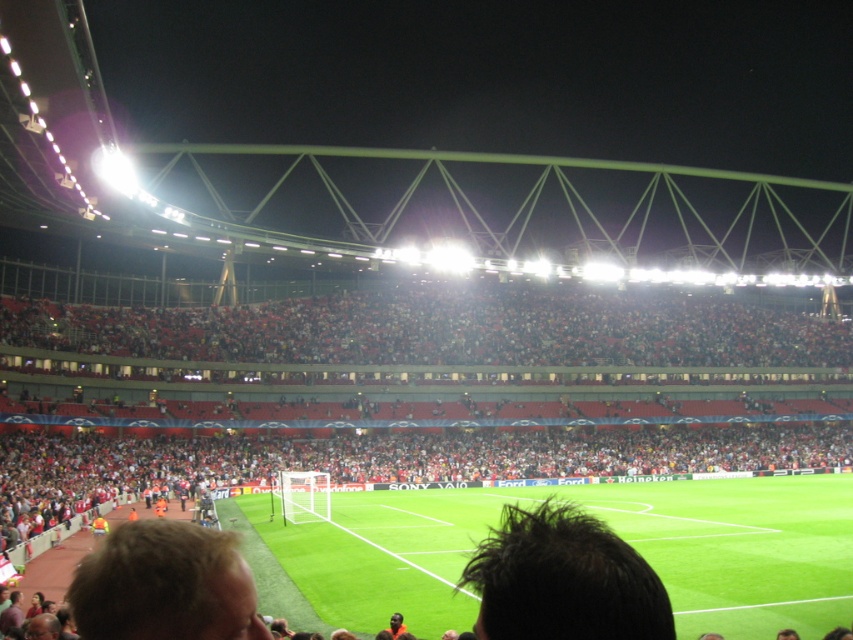
Question: Does dark brown hair at center appear over blonde hair at lower left?

Choices:
 (A) no
 (B) yes

Answer: (A)

Question: Which point is closer to the camera?

Choices:
 (A) blonde hair at lower left
 (B) dark brown hair at center
 (C) green grass football field at center

Answer: (B)

Question: Is green grass football field at center to the right of blonde hair at lower left from the viewer's perspective?

Choices:
 (A) no
 (B) yes

Answer: (B)

Question: Which object is farther from the camera taking this photo?

Choices:
 (A) dark brown hair at center
 (B) green grass football field at center

Answer: (B)

Question: Which of the following is the closest to the observer?

Choices:
 (A) (724, 532)
 (B) (108, 609)

Answer: (B)

Question: Can you confirm if green grass football field at center is positioned above blonde hair at lower left?

Choices:
 (A) no
 (B) yes

Answer: (A)